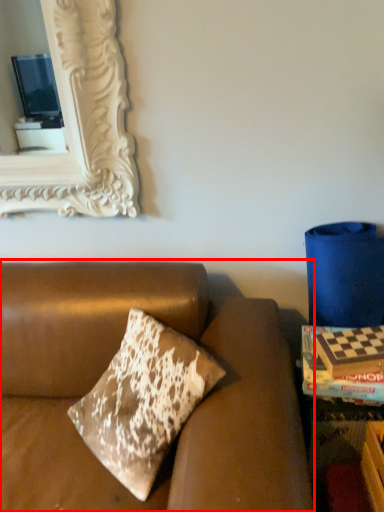
Question: From the image's perspective, where is studio couch (annotated by the red box) located relative to magazine?

Choices:
 (A) below
 (B) above

Answer: (A)